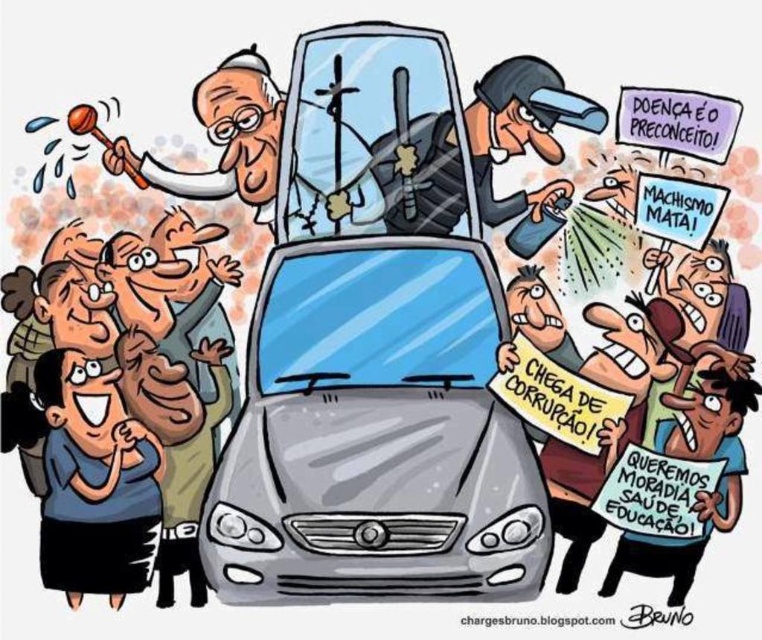
Who is taller, gray metallic car at center or white paper sign at center?

gray metallic car at center

Between gray metallic car at center and white paper sign at center, which one appears on the right side from the viewer's perspective?

white paper sign at center is more to the right.

What do you see at coordinates (375, 435) in the screenshot? The image size is (762, 640). I see `gray metallic car at center` at bounding box center [375, 435].

What are the coordinates of `gray metallic car at center` in the screenshot? It's located at (375, 435).

This screenshot has height=640, width=762. Describe the element at coordinates (122, 400) in the screenshot. I see `blue shirt at lower left` at that location.

Between blue shirt at lower left and brown paper sign at lower right, which one has more height?

Standing taller between the two is blue shirt at lower left.

What do you see at coordinates (122, 400) in the screenshot?
I see `blue shirt at lower left` at bounding box center [122, 400].

Locate an element on the screen. The image size is (762, 640). blue shirt at lower left is located at coordinates (122, 400).

Between gray metallic car at center and black plastic helmet at center, which one is positioned lower?

gray metallic car at center

Who is more distant from viewer, (258, 436) or (482, 138)?

Point (482, 138)

Between point (495, 552) and point (426, 129), which one is positioned in front?

Point (495, 552) is more forward.

Where is `gray metallic car at center`? gray metallic car at center is located at coordinates (375, 435).